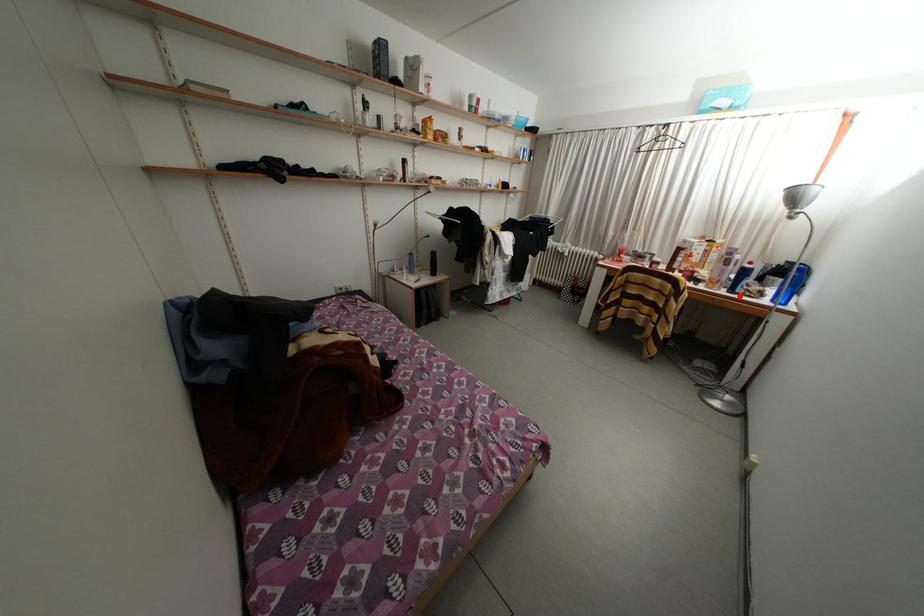
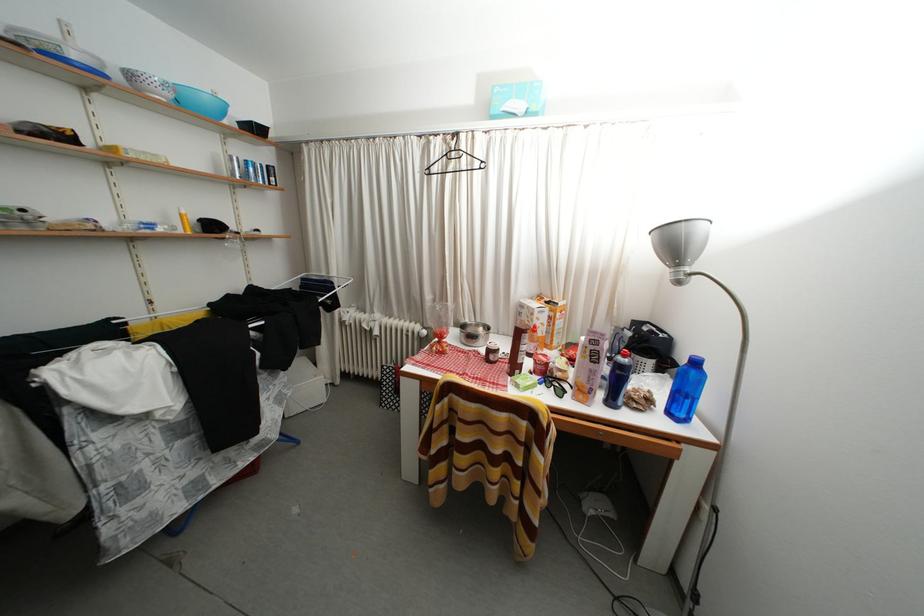
Question: I am providing you with two images of the same scene from different viewpoints. Image1 has a red point marked. In image2, the corresponding 3D location appears at what relative position? Reply with the corresponding letter.

Choices:
 (A) Closer
 (B) Farther

Answer: (B)